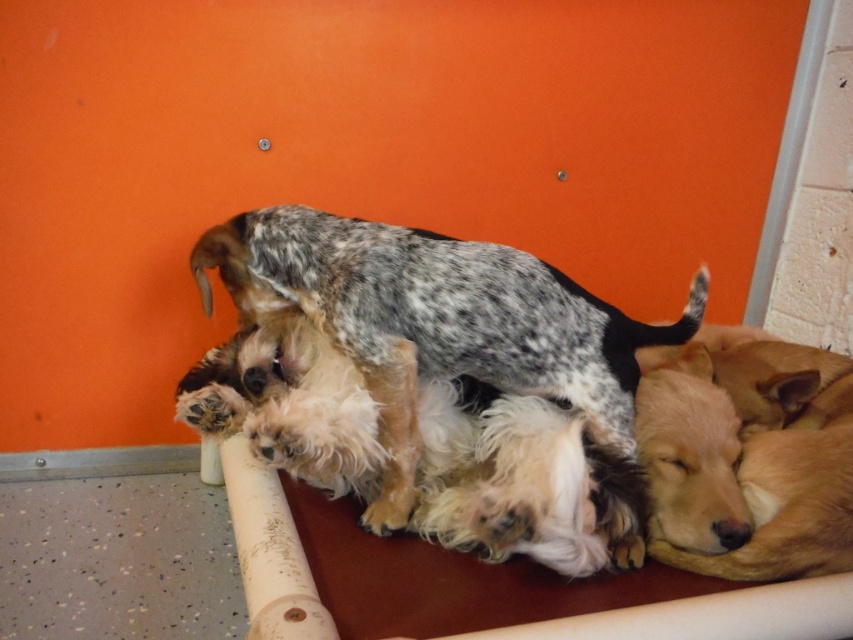
Question: Does speckled fur dog at center appear under golden fur dog at lower right?

Choices:
 (A) yes
 (B) no

Answer: (B)

Question: Is speckled fur dog at center below golden fur dog at lower right?

Choices:
 (A) no
 (B) yes

Answer: (A)

Question: Which object is closer to the camera taking this photo?

Choices:
 (A) golden fur dog at lower right
 (B) speckled fur dog at center

Answer: (A)

Question: Can you confirm if speckled fur dog at center is positioned to the right of golden fur dog at lower right?

Choices:
 (A) no
 (B) yes

Answer: (A)

Question: Among these objects, which one is nearest to the camera?

Choices:
 (A) golden fur dog at lower right
 (B) speckled fur dog at center

Answer: (A)